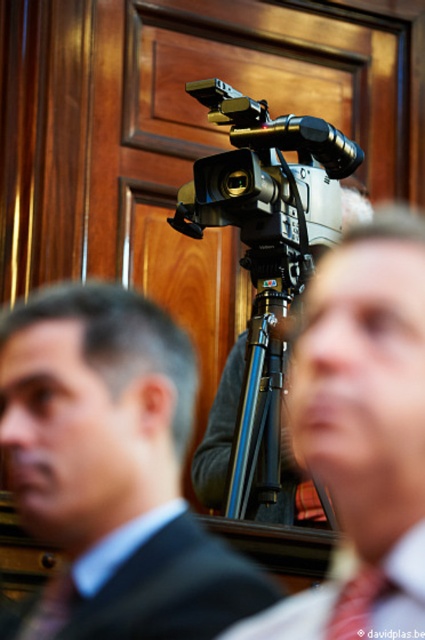
Question: Can you confirm if matte black suit at center is smaller than matte black camera at center?

Choices:
 (A) no
 (B) yes

Answer: (B)

Question: Among these points, which one is nearest to the camera?

Choices:
 (A) (223, 589)
 (B) (340, 554)

Answer: (A)

Question: Where is matte black suit at center located in relation to red silk tie at center in the image?

Choices:
 (A) left
 (B) right

Answer: (A)

Question: Which object is farther from the camera taking this photo?

Choices:
 (A) silver metallic camera at center
 (B) matte black camera at center

Answer: (A)

Question: Is silver metallic camera at center smaller than black fabric suit at center?

Choices:
 (A) no
 (B) yes

Answer: (B)

Question: Considering the real-world distances, which object is closest to the matte black camera at center?

Choices:
 (A) silver metallic camera at center
 (B) black fabric suit at center

Answer: (B)